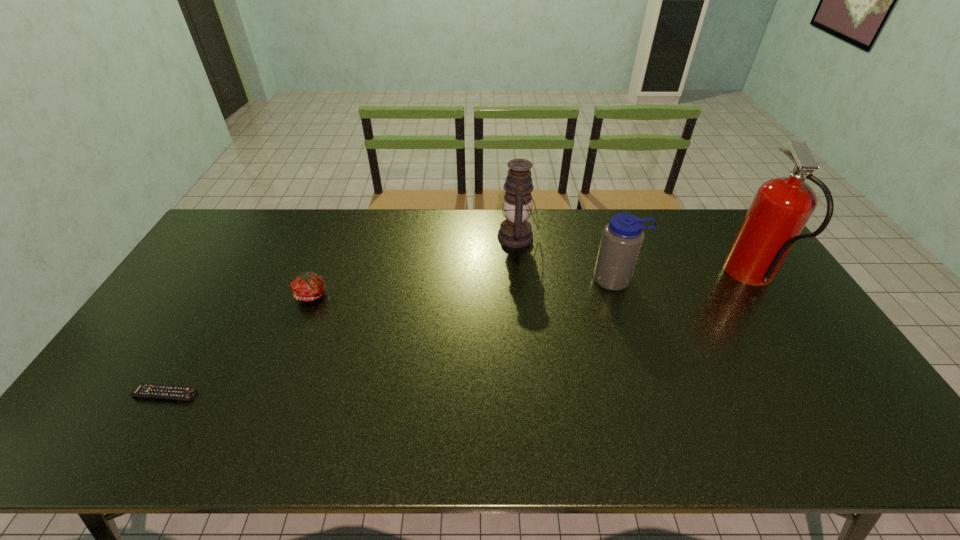
This screenshot has height=540, width=960. In order to click on the tallest object in this screenshot , I will do `click(781, 208)`.

The width and height of the screenshot is (960, 540). What are the coordinates of `fire extinguisher` in the screenshot? It's located at (781, 208).

Locate an element on the screen. oil lamp is located at coordinates (515, 231).

Locate an element on the screen. The image size is (960, 540). the fourth shortest object is located at coordinates (515, 231).

Locate an element on the screen. The height and width of the screenshot is (540, 960). water bottle is located at coordinates (622, 238).

You are a GUI agent. You are given a task and a screenshot of the screen. Output one action in this format:
    pyautogui.click(x=<x>, y=<y>)
    Task: Click on the second object from right to left
    
    Given the screenshot: What is the action you would take?
    pyautogui.click(x=622, y=238)

The image size is (960, 540). Identify the location of the fourth tallest object. (308, 286).

In order to click on tomato in this screenshot , I will do `click(308, 286)`.

Identify the location of remote control. This screenshot has width=960, height=540. (146, 390).

This screenshot has height=540, width=960. I want to click on the shortest object, so click(x=146, y=390).